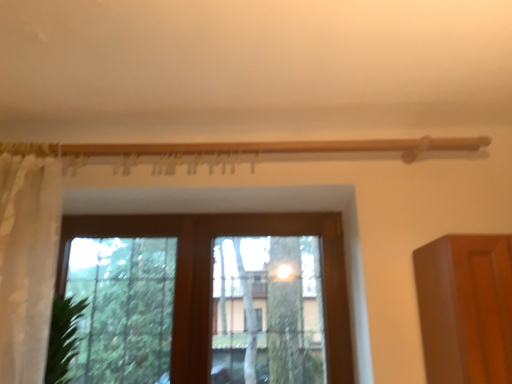
Question: From a real-world perspective, is brown wooden window at center on white sheer curtain at left?

Choices:
 (A) no
 (B) yes

Answer: (A)

Question: Is white sheer curtain at left a part of brown wooden window at center?

Choices:
 (A) yes
 (B) no

Answer: (B)

Question: Does brown wooden window at center have a greater height compared to white sheer curtain at left?

Choices:
 (A) no
 (B) yes

Answer: (A)

Question: Is brown wooden window at center shorter than white sheer curtain at left?

Choices:
 (A) yes
 (B) no

Answer: (A)

Question: Is brown wooden window at center looking in the opposite direction of white sheer curtain at left?

Choices:
 (A) yes
 (B) no

Answer: (B)

Question: From the image's perspective, is brown wooden window at center under white sheer curtain at left?

Choices:
 (A) no
 (B) yes

Answer: (B)

Question: Considering the relative sizes of white sheer curtain at left and brown wooden window at center in the image provided, is white sheer curtain at left thinner than brown wooden window at center?

Choices:
 (A) no
 (B) yes

Answer: (A)

Question: Is white sheer curtain at left not near brown wooden window at center?

Choices:
 (A) yes
 (B) no

Answer: (B)

Question: Is white sheer curtain at left positioned with its back to brown wooden window at center?

Choices:
 (A) no
 (B) yes

Answer: (B)

Question: From a real-world perspective, is white sheer curtain at left physically above brown wooden window at center?

Choices:
 (A) yes
 (B) no

Answer: (A)

Question: Does white sheer curtain at left touch brown wooden window at center?

Choices:
 (A) no
 (B) yes

Answer: (A)

Question: Could you tell me if white sheer curtain at left is facing brown wooden window at center?

Choices:
 (A) no
 (B) yes

Answer: (A)

Question: Considering the positions of brown wooden window at center and white sheer curtain at left in the image, is brown wooden window at center bigger or smaller than white sheer curtain at left?

Choices:
 (A) small
 (B) big

Answer: (B)